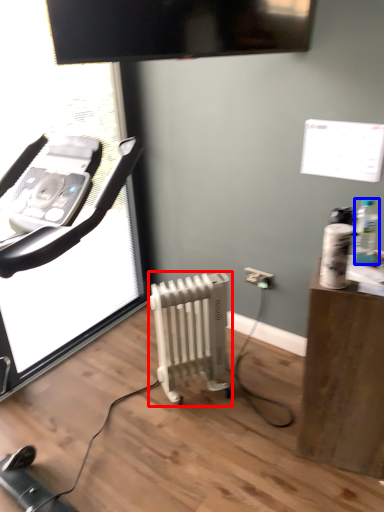
Question: Which object is closer to the camera taking this photo, radiator (highlighted by a red box) or bottle (highlighted by a blue box)?

Choices:
 (A) radiator
 (B) bottle

Answer: (B)